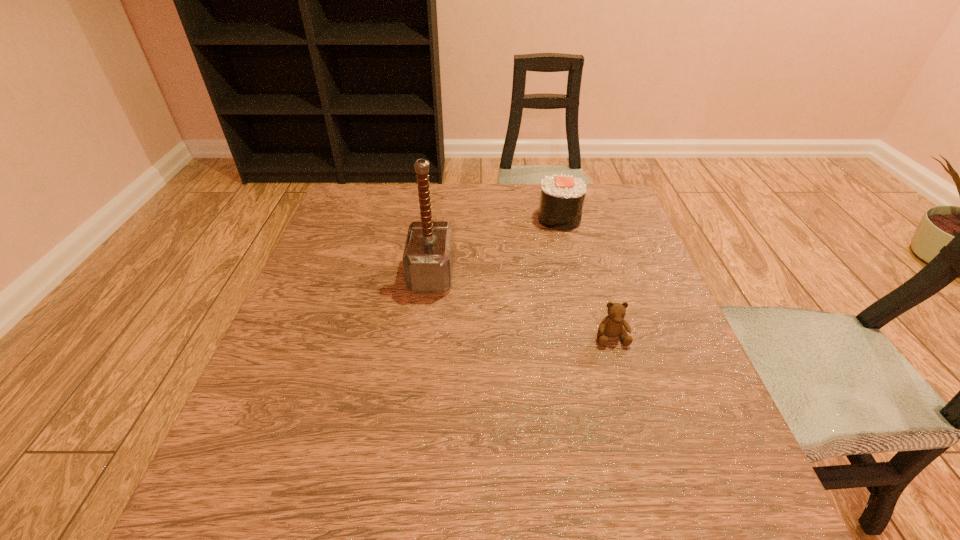
At what (x,y) coordinates should I click in order to perform the action: click on sushi present at the right edge. Please return your answer as a coordinate pair (x, y). Looking at the image, I should click on (562, 197).

Where is `teddy bear located in the right edge section of the desktop`? teddy bear located in the right edge section of the desktop is located at coordinates (611, 326).

This screenshot has width=960, height=540. I want to click on object at the far right corner, so click(562, 197).

Where is `vacant space at the far edge of the desktop`? Image resolution: width=960 pixels, height=540 pixels. vacant space at the far edge of the desktop is located at coordinates point(488,193).

Where is `free region at the left edge`? The height and width of the screenshot is (540, 960). free region at the left edge is located at coordinates (335, 381).

Locate an element on the screen. The image size is (960, 540). vacant point at the right edge is located at coordinates (612, 245).

The width and height of the screenshot is (960, 540). Find the location of `free region at the far left corner of the desktop`. free region at the far left corner of the desktop is located at coordinates (385, 214).

This screenshot has width=960, height=540. I want to click on vacant space at the near right corner of the desktop, so click(x=733, y=490).

The width and height of the screenshot is (960, 540). Find the location of `vacant point located between the nearest object and the sushi`. vacant point located between the nearest object and the sushi is located at coordinates (585, 278).

You are a GUI agent. You are given a task and a screenshot of the screen. Output one action in this format:
    pyautogui.click(x=<x>, y=<y>)
    Task: Click on the free space between the sushi and the nearest object
    The width and height of the screenshot is (960, 540).
    Given the screenshot: What is the action you would take?
    pyautogui.click(x=585, y=278)